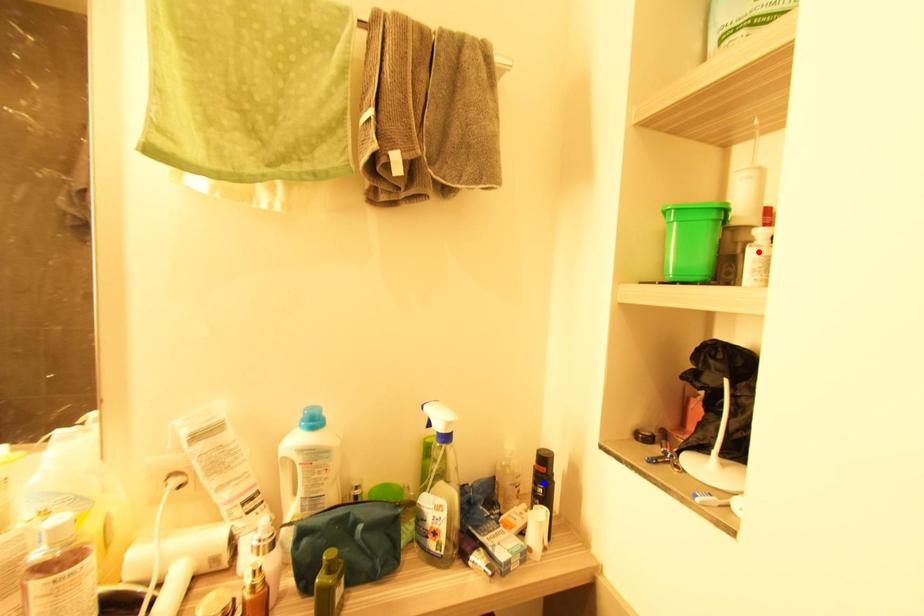
Question: In the image, two points are highlighted. Which point is nearer to the camera? Reply with the corresponding letter.

Choices:
 (A) blue point
 (B) red point

Answer: (B)